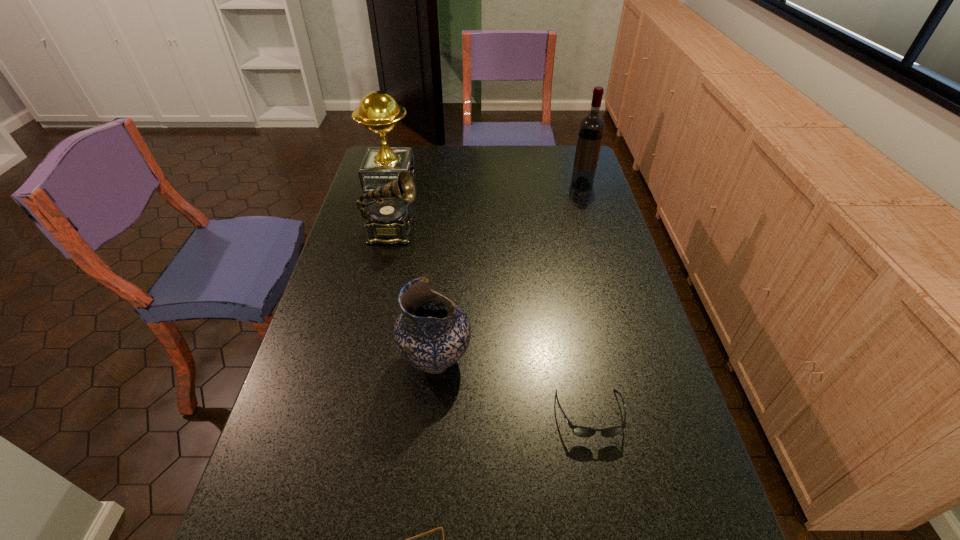
The width and height of the screenshot is (960, 540). In order to click on vacant position located 0.070m on the front-facing side of the taller sunglasses in this screenshot , I will do `click(602, 474)`.

This screenshot has width=960, height=540. In order to click on object situated at the far edge in this screenshot , I will do `click(378, 111)`.

The width and height of the screenshot is (960, 540). Identify the location of award that is at the left edge. (378, 111).

Identify the location of phonograph record situated at the left edge. This screenshot has width=960, height=540. (389, 221).

I want to click on wine bottle that is positioned at the right edge, so click(x=591, y=130).

Locate an element on the screen. sunglasses situated at the right edge is located at coordinates (579, 431).

You are a GUI agent. You are given a task and a screenshot of the screen. Output one action in this format:
    pyautogui.click(x=<x>, y=<y>)
    Task: Click on the object that is at the far left corner
    The image size is (960, 540).
    Given the screenshot: What is the action you would take?
    (x=378, y=111)

Image resolution: width=960 pixels, height=540 pixels. What are the coordinates of `vacant space at the far edge of the desktop` in the screenshot? It's located at (468, 153).

In the image, there is a desktop. Where is `blank space at the left edge`? This screenshot has height=540, width=960. blank space at the left edge is located at coordinates (320, 394).

Locate an element on the screen. Image resolution: width=960 pixels, height=540 pixels. vacant space at the right edge is located at coordinates (707, 497).